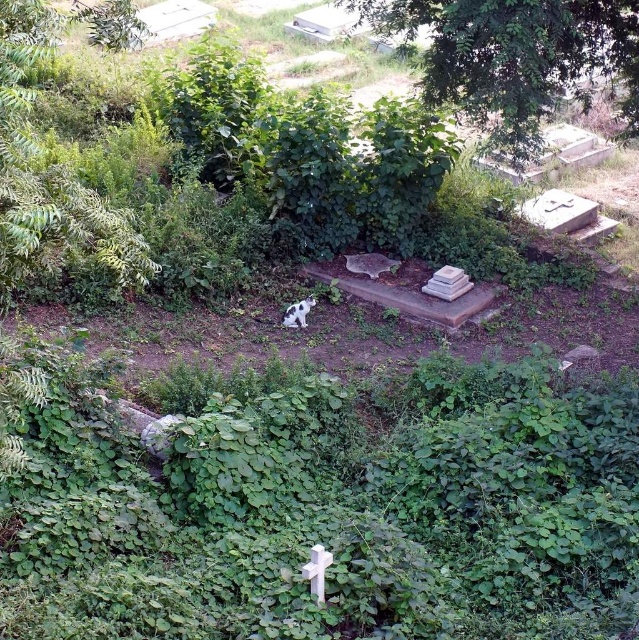
You are a photographer trying to capture the spotted fur cat at center in your shot. However, there are green leafy plants at center blocking the view. Can you move the plants to get a clear shot of the cat?

The green leafy plants at center are in front of the spotted fur cat at center, so you can move the plants to get a clear shot of the cat.

You are a gardener trying to clear the cemetery. You notice the green leafy plants at center. Where exactly are they positioned in the image?

The green leafy plants at center are located at point coordinates of approximately 0.798 on the x axis and 0.518 on the y axis.